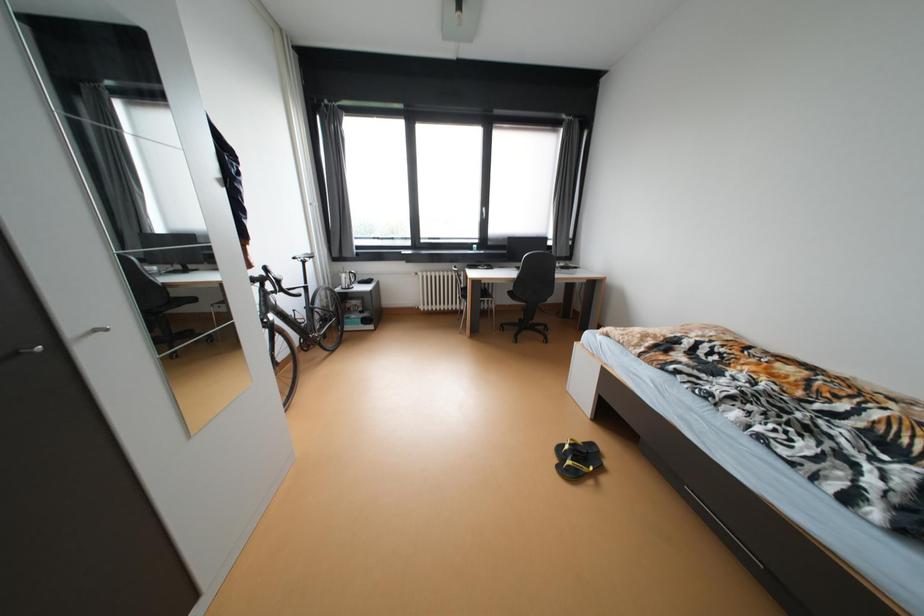
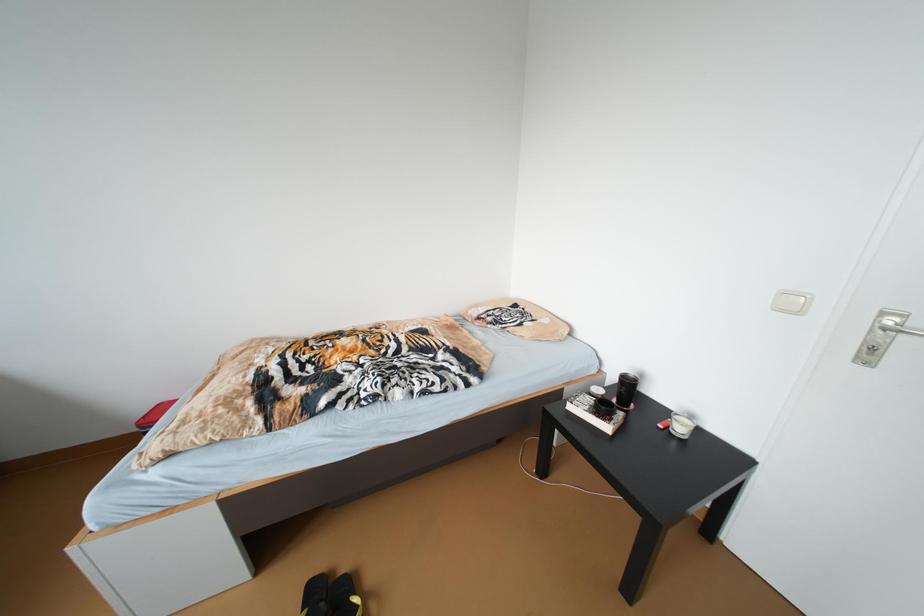
The images are taken continuously from a first-person perspective. In which direction is your viewpoint rotating?

The camera's rotation is toward right-down.